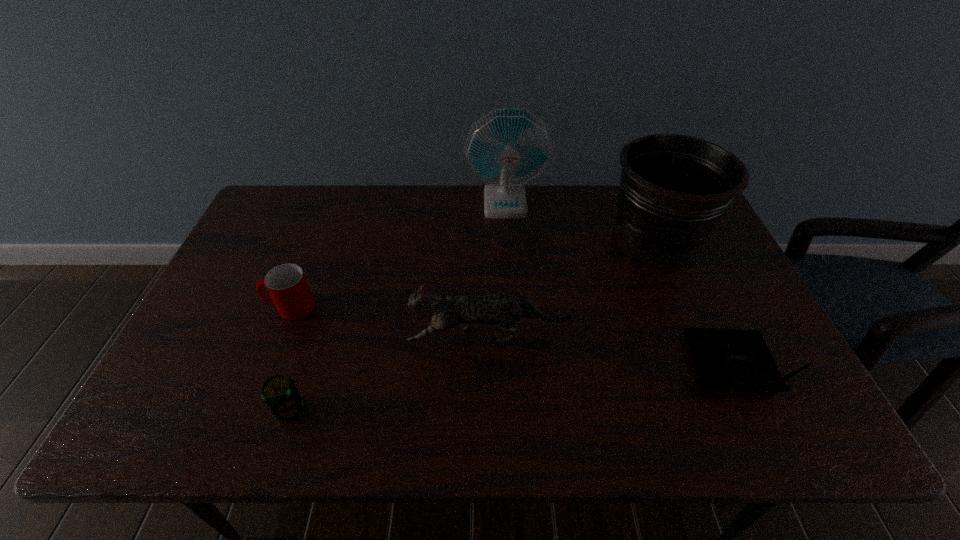
The width and height of the screenshot is (960, 540). I want to click on free space located on the face of the fourth shortest object, so click(x=332, y=337).

Where is `free space located 0.140m on the side of the cup with the handle`? The height and width of the screenshot is (540, 960). free space located 0.140m on the side of the cup with the handle is located at coordinates (213, 307).

You are a GUI agent. You are given a task and a screenshot of the screen. Output one action in this format:
    pyautogui.click(x=<x>, y=<y>)
    Task: Click on the vacant space positioned 0.070m on the side of the cup with the handle
    The height and width of the screenshot is (540, 960).
    Given the screenshot: What is the action you would take?
    pyautogui.click(x=240, y=307)

I want to click on vacant point located on the side of the cup with the handle, so click(x=225, y=307).

What are the coordinates of `free space located 0.210m on the left of the router` in the screenshot? It's located at (587, 368).

I want to click on blank space located 0.380m on the right of the beer can, so click(x=477, y=409).

At what (x,y) coordinates should I click in order to perform the action: click on fan at the far edge. Please return your answer as a coordinate pair (x, y). The image size is (960, 540). Looking at the image, I should click on (508, 148).

The width and height of the screenshot is (960, 540). I want to click on bucket that is positioned at the far edge, so click(674, 189).

This screenshot has height=540, width=960. In order to click on router situated at the near edge in this screenshot , I will do `click(733, 359)`.

I want to click on beer can that is at the near edge, so click(x=280, y=394).